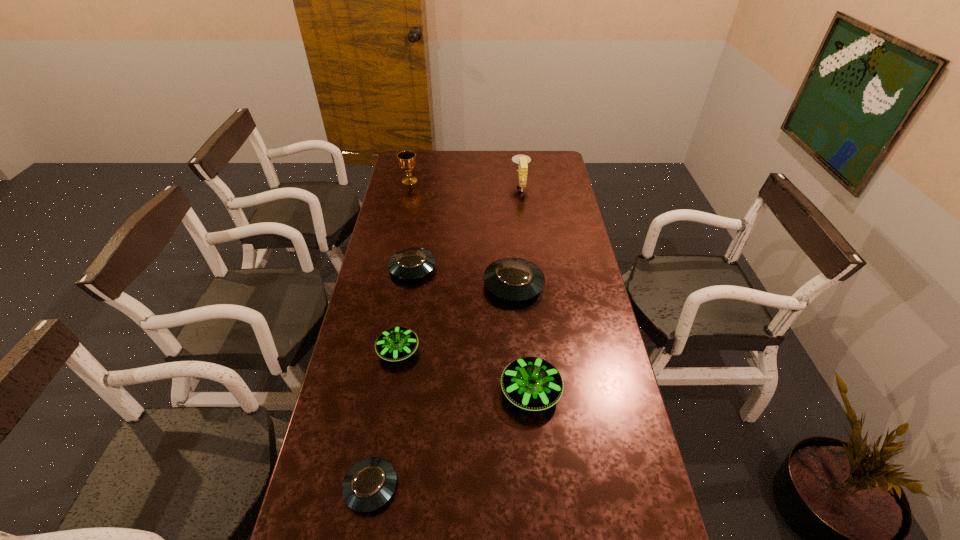
This screenshot has height=540, width=960. I want to click on yellow sponge, so click(522, 160).

What are the coordinates of `gold chalice` in the screenshot? It's located at (407, 162).

Image resolution: width=960 pixels, height=540 pixels. In order to click on the bigger green saucer in this screenshot , I will do `click(531, 383)`.

Where is `the rightmost gray saucer`? the rightmost gray saucer is located at coordinates (514, 279).

Identify the location of the smaller green saucer. (397, 343).

Where is `the second smallest gray saucer`? the second smallest gray saucer is located at coordinates (411, 263).

Find the location of a particular element. the nearest gray saucer is located at coordinates (369, 484).

Find the location of `the nearest object`. the nearest object is located at coordinates (369, 484).

Identify the location of free space located 0.270m on the front-facing side of the yellow sponge. (455, 186).

I want to click on vacant space situated on the front-facing side of the yellow sponge, so [x=436, y=186].